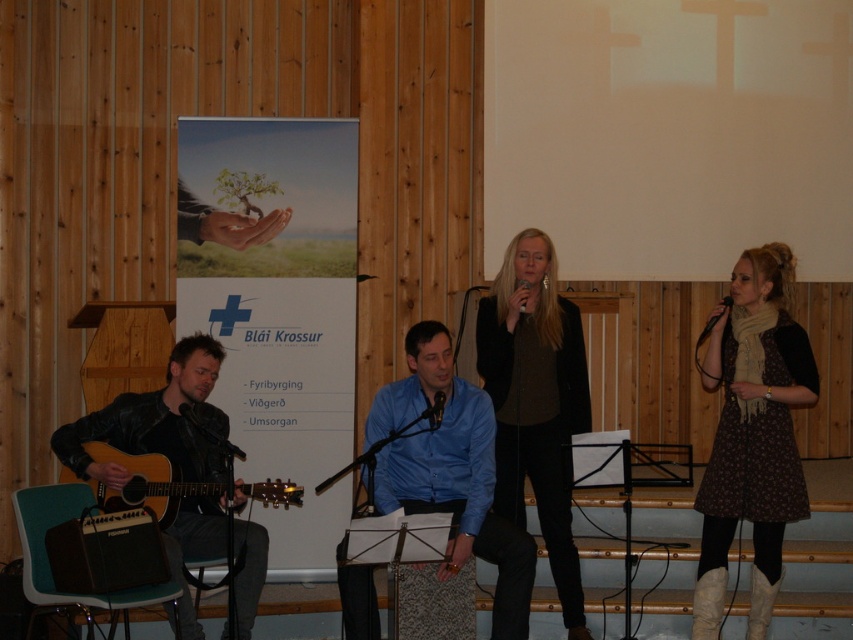
Question: Among these points, which one is nearest to the camera?

Choices:
 (A) (529, 289)
 (B) (706, 336)

Answer: (A)

Question: Can you confirm if black matte jacket at center is positioned above leather jacket at left?

Choices:
 (A) yes
 (B) no

Answer: (A)

Question: Does brown floral dress at right come in front of blue shirt at center?

Choices:
 (A) no
 (B) yes

Answer: (A)

Question: From the image, what is the correct spatial relationship of black matte jacket at center in relation to black matte microphone at lower left?

Choices:
 (A) left
 (B) right

Answer: (B)

Question: Which point appears closest to the camera in this image?

Choices:
 (A) (242, 576)
 (B) (440, 412)
 (C) (759, 324)
 (D) (445, 573)

Answer: (B)

Question: Which point is farther to the camera?

Choices:
 (A) (509, 577)
 (B) (216, 449)
 (C) (726, 308)
 (D) (432, 400)

Answer: (B)